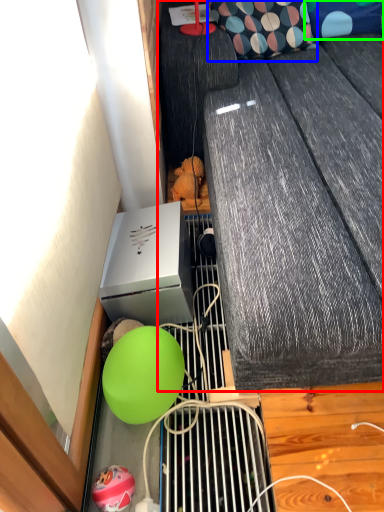
Question: Considering the real-world distances, which object is closest to furniture (highlighted by a red box)? pillow (highlighted by a blue box) or pillow (highlighted by a green box).

Choices:
 (A) pillow
 (B) pillow

Answer: (A)